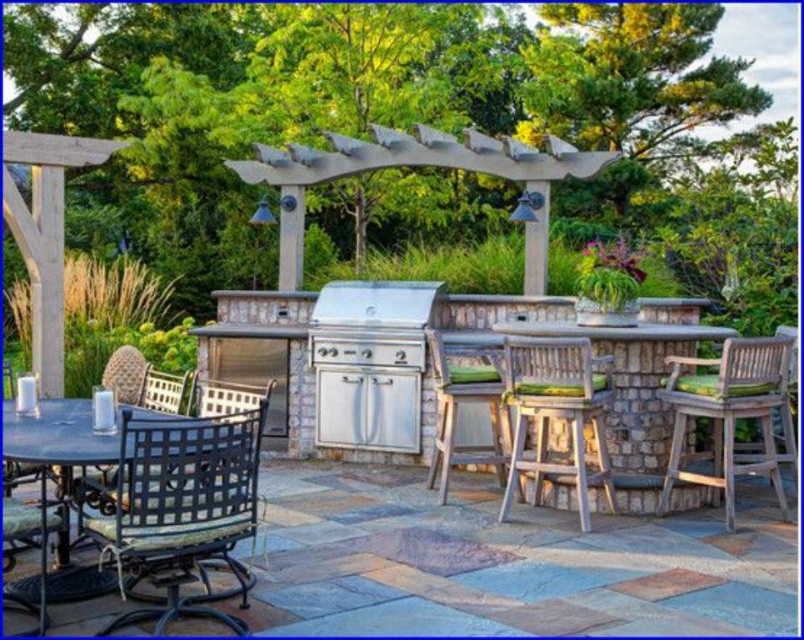
Is teak wood bar stool at right bigger than metallic silver exhaust hood at upper center?

No.

Can you confirm if teak wood bar stool at right is positioned above metallic silver exhaust hood at upper center?

Actually, teak wood bar stool at right is below metallic silver exhaust hood at upper center.

The image size is (804, 640). What are the coordinates of `teak wood bar stool at right` in the screenshot? It's located at (728, 413).

Locate an element on the screen. The width and height of the screenshot is (804, 640). teak wood bar stool at right is located at coordinates (728, 413).

Which is more to the right, metallic silver exhaust hood at upper center or metallic woven chair at center?

Positioned to the right is metallic silver exhaust hood at upper center.

This screenshot has height=640, width=804. What do you see at coordinates (419, 157) in the screenshot? I see `metallic silver exhaust hood at upper center` at bounding box center [419, 157].

The height and width of the screenshot is (640, 804). In order to click on metallic silver exhaust hood at upper center in this screenshot , I will do `click(419, 157)`.

Which is above, teak wood table at center or metallic silver exhaust hood at upper center?

Positioned higher is metallic silver exhaust hood at upper center.

Does teak wood table at center appear on the left side of metallic silver exhaust hood at upper center?

Incorrect, teak wood table at center is not on the left side of metallic silver exhaust hood at upper center.

Which is in front, point (610, 330) or point (279, 172)?

Point (610, 330) is more forward.

Image resolution: width=804 pixels, height=640 pixels. I want to click on teak wood table at center, so click(632, 396).